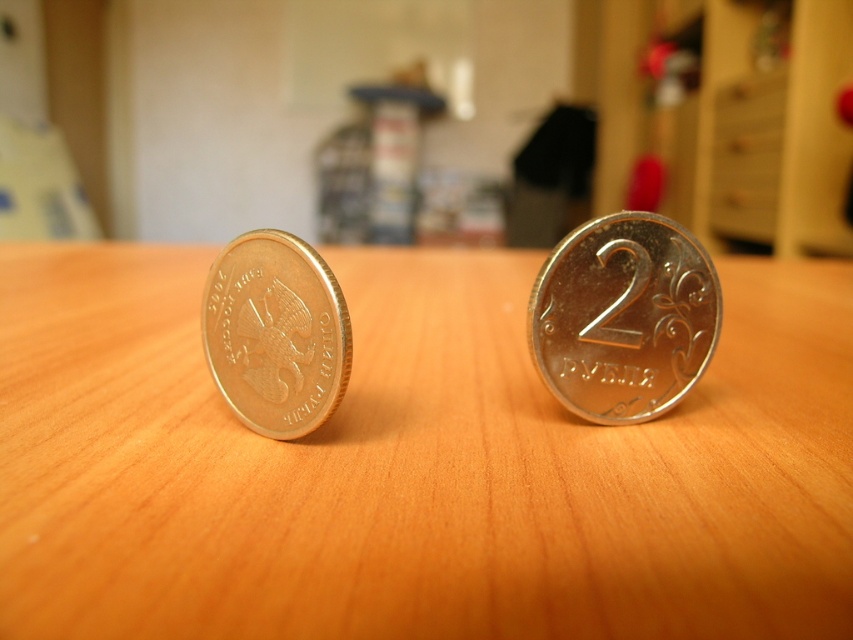
Which is more to the left, wooden table at center or silver/metallic coin at center?

wooden table at center is more to the left.

Can you confirm if wooden table at center is positioned below silver/metallic coin at center?

Incorrect, wooden table at center is not positioned below silver/metallic coin at center.

Does point (637, 488) lie behind point (668, 257)?

No, (637, 488) is closer to viewer.

The height and width of the screenshot is (640, 853). What are the coordinates of `wooden table at center` in the screenshot? It's located at (413, 465).

From the picture: Between wooden table at center and gold metallic coin at left, which one is positioned higher?

wooden table at center is above.

Does wooden table at center appear on the left side of gold metallic coin at left?

In fact, wooden table at center is to the right of gold metallic coin at left.

Measure the distance between point (x=154, y=264) and camera.

Point (x=154, y=264) is 2.50 meters from camera.

Locate an element on the screen. This screenshot has height=640, width=853. wooden table at center is located at coordinates (413, 465).

Does silver/metallic coin at center appear on the right side of gold metallic coin at left?

Yes, silver/metallic coin at center is to the right of gold metallic coin at left.

Can you confirm if silver/metallic coin at center is bigger than gold metallic coin at left?

Actually, silver/metallic coin at center might be smaller than gold metallic coin at left.

Which is in front, point (538, 292) or point (268, 285)?

Point (268, 285) is in front.

Locate an element on the screen. Image resolution: width=853 pixels, height=640 pixels. silver/metallic coin at center is located at coordinates (624, 317).